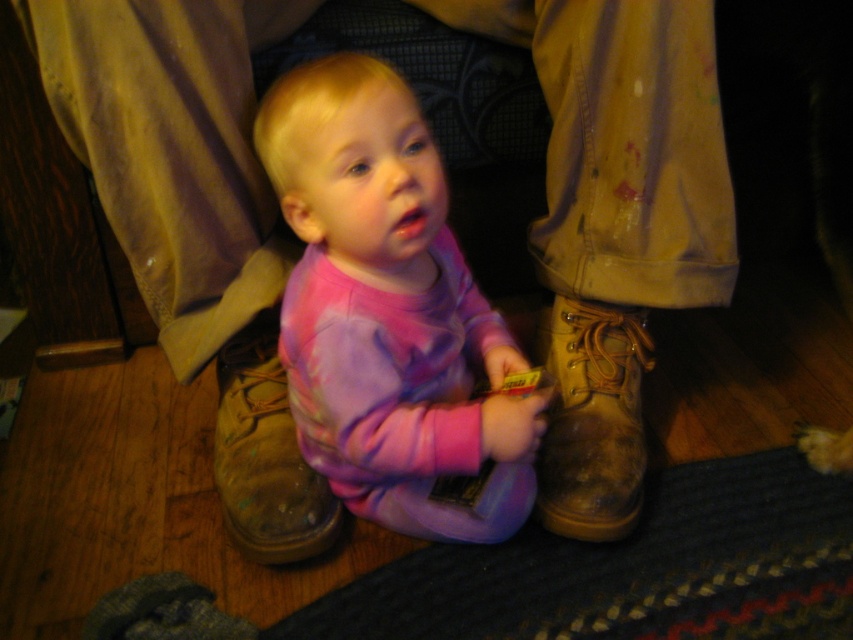
What do you see at coordinates (386, 307) in the screenshot? I see `pink tie-dye shirt at center` at bounding box center [386, 307].

Can you confirm if pink tie-dye shirt at center is shorter than brown leather boot at lower center?

No.

Which is behind, point (372, 381) or point (254, 524)?

Positioned behind is point (254, 524).

This screenshot has height=640, width=853. I want to click on pink tie-dye shirt at center, so click(x=386, y=307).

Who is taller, pink tie-dye shirt at center or leather boot at lower center?

Standing taller between the two is pink tie-dye shirt at center.

Between pink tie-dye shirt at center and leather boot at lower center, which one has less height?

Standing shorter between the two is leather boot at lower center.

Locate an element on the screen. This screenshot has width=853, height=640. pink tie-dye shirt at center is located at coordinates (386, 307).

Does leather boot at lower center appear on the right side of brown leather boot at lower center?

Correct, you'll find leather boot at lower center to the right of brown leather boot at lower center.

Who is more forward, (x=555, y=336) or (x=253, y=464)?

Point (x=253, y=464) is in front.

The height and width of the screenshot is (640, 853). Identify the location of leather boot at lower center. click(592, 419).